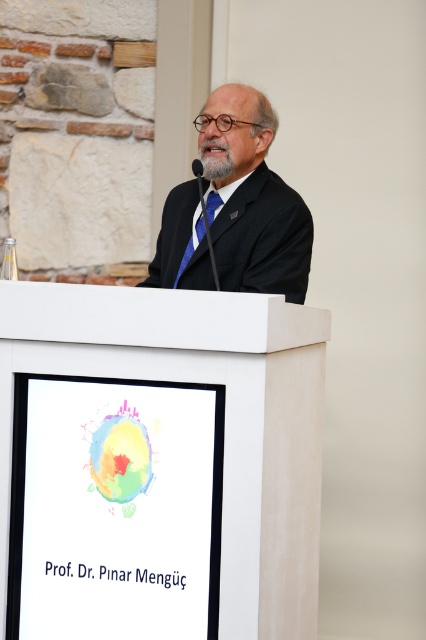
Looking at this image, you are an event planner observing the stage setup. You need to adjust the lighting to highlight both the white matte podium at center and the black matte suit at center. Since the podium is positioned under the suit, where should you direct the light to ensure both are well illuminated?

Since the white matte podium at center is positioned under the black matte suit at center, directing light downward from above the black matte suit at center will illuminate both the suit and the podium effectively.